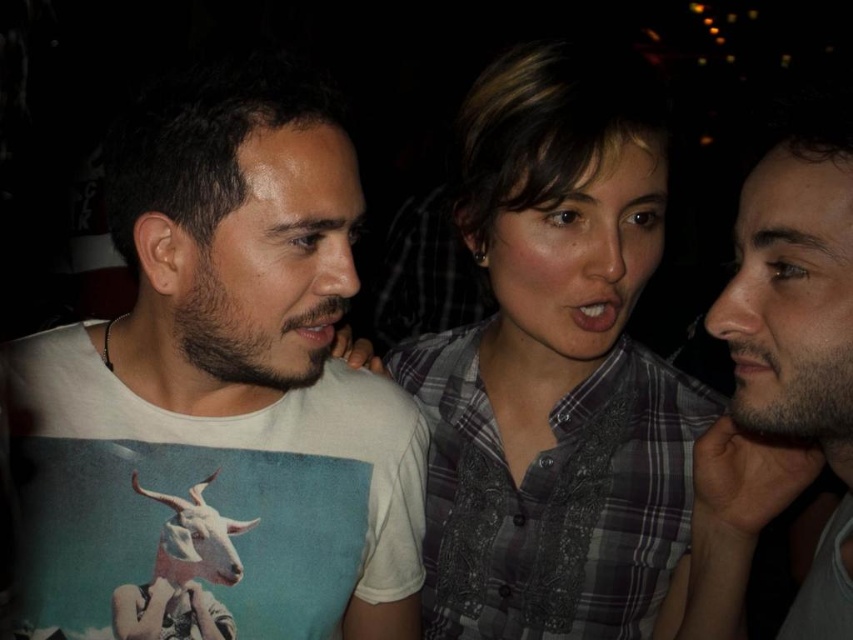
Between point (556, 544) and point (817, 248), which one is positioned behind?

The point (556, 544) is behind.

Which is more to the right, plaid shirt at center or beige fabric shirt at center?

From the viewer's perspective, beige fabric shirt at center appears more on the right side.

Is point (512, 96) less distant than point (714, 596)?

Yes, it is.

Where is `plaid shirt at center`? The height and width of the screenshot is (640, 853). plaid shirt at center is located at coordinates (556, 365).

Can you confirm if white cotton t-shirt at left is positioned below beige fabric shirt at center?

No, white cotton t-shirt at left is not below beige fabric shirt at center.

Which is in front, point (315, 349) or point (762, 476)?

Point (315, 349) is more forward.

Identify the location of white cotton t-shirt at left. (218, 396).

At what (x,y) coordinates should I click in order to perform the action: click on white cotton t-shirt at left. Please return your answer as a coordinate pair (x, y). The image size is (853, 640). Looking at the image, I should click on (218, 396).

Who is positioned more to the right, white cotton t-shirt at left or plaid shirt at center?

plaid shirt at center

Is white cotton t-shirt at left wider than plaid shirt at center?

Yes.

Which is in front, point (170, 228) or point (550, 579)?

Positioned in front is point (170, 228).

Image resolution: width=853 pixels, height=640 pixels. In order to click on white cotton t-shirt at left in this screenshot , I will do `click(218, 396)`.